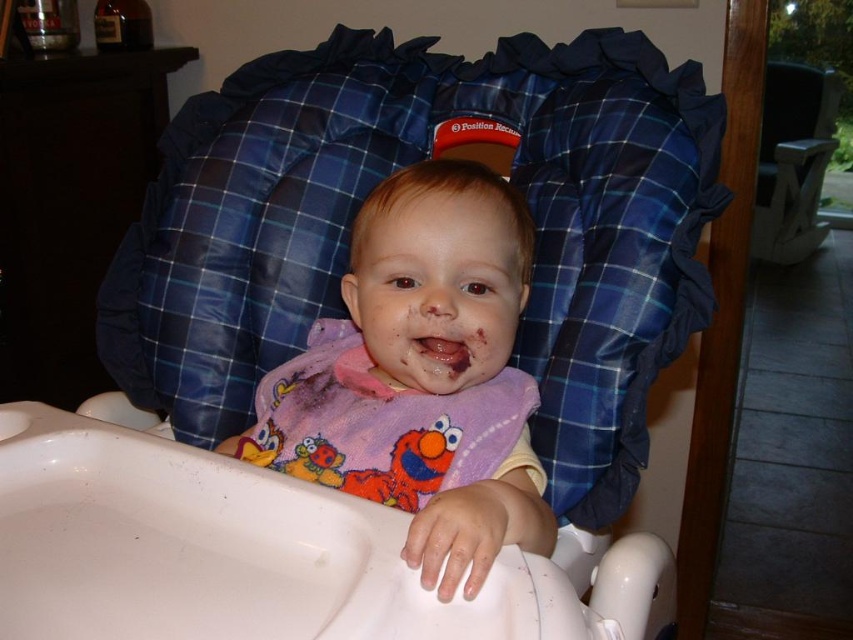
Can you confirm if purple fabric bib at center is positioned below purple fleece bib at center?

Indeed, purple fabric bib at center is positioned under purple fleece bib at center.

Does point (486, 525) lie behind point (480, 428)?

No, it is in front of (480, 428).

Identify the location of purple fabric bib at center. (421, 376).

What do you see at coordinates (386, 426) in the screenshot? I see `purple fleece bib at center` at bounding box center [386, 426].

Does purple fleece bib at center have a lesser width compared to plaid fabric highchair at upper right?

Incorrect, purple fleece bib at center's width is not less than plaid fabric highchair at upper right's.

Where is `purple fleece bib at center`? purple fleece bib at center is located at coordinates (386, 426).

What are the coordinates of `purple fleece bib at center` in the screenshot? It's located at (386, 426).

Does purple fleece bib at center appear on the left side of dry skin at mouth center?

Yes, purple fleece bib at center is to the left of dry skin at mouth center.

Is purple fleece bib at center taller than dry skin at mouth center?

Correct, purple fleece bib at center is much taller as dry skin at mouth center.

Who is more distant from viewer, (502, 410) or (426, 342)?

The point (502, 410) is behind.

Find the location of a particular element. Image resolution: width=853 pixels, height=640 pixels. purple fleece bib at center is located at coordinates (386, 426).